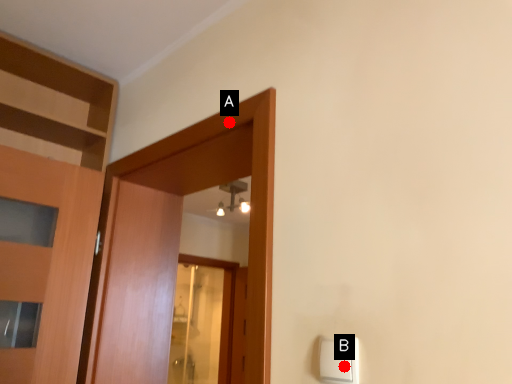
Question: Two points are circled on the image, labeled by A and B beside each circle. Which point is closer to the camera?

Choices:
 (A) A is closer
 (B) B is closer

Answer: (B)